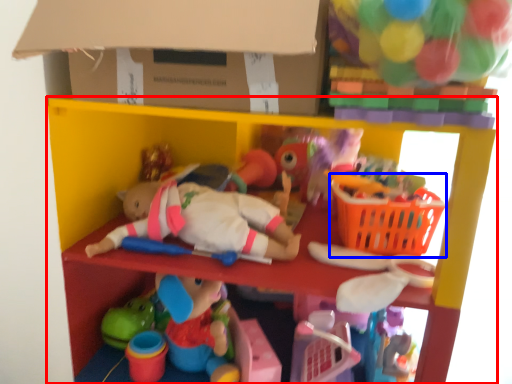
Question: Among these objects, which one is farthest to the camera, shelf (highlighted by a red box) or basket (highlighted by a blue box)?

Choices:
 (A) shelf
 (B) basket

Answer: (B)